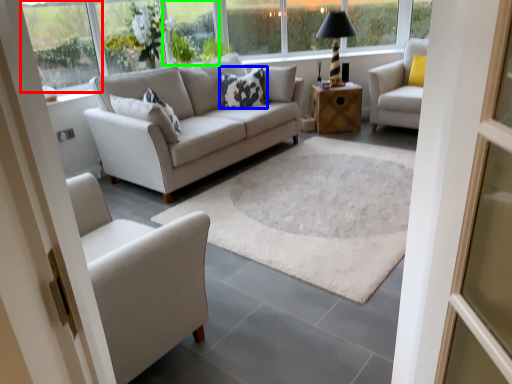
Question: Which object is the farthest from window (highlighted by a red box)? Choose among these: pillow (highlighted by a blue box) or window (highlighted by a green box).

Choices:
 (A) pillow
 (B) window

Answer: (A)